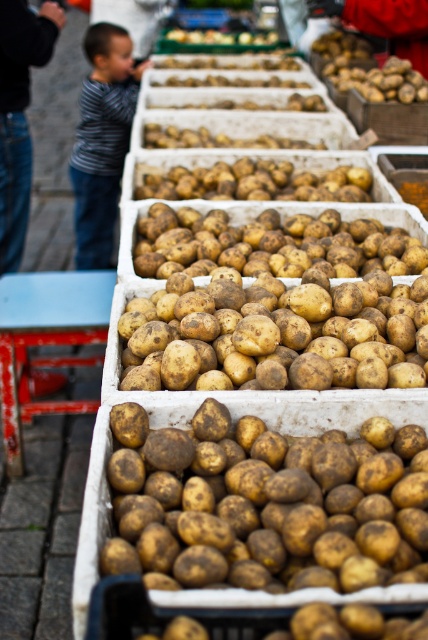
This screenshot has height=640, width=428. What do you see at coordinates (259, 346) in the screenshot?
I see `brown matte potatoes at center` at bounding box center [259, 346].

Can you confirm if brown matte potatoes at center is taller than rustic brown potato at center?

No, brown matte potatoes at center is not taller than rustic brown potato at center.

The height and width of the screenshot is (640, 428). Find the location of `brown matte potatoes at center`. brown matte potatoes at center is located at coordinates (259, 346).

Can you confirm if brown rough potato at center is positioned above striped shirt at left?

No.

Can you confirm if brown rough potato at center is shorter than striped shirt at left?

Yes, brown rough potato at center is shorter than striped shirt at left.

What do you see at coordinates (253, 508) in the screenshot? I see `brown rough potato at center` at bounding box center [253, 508].

The height and width of the screenshot is (640, 428). What are the coordinates of `brown rough potato at center` in the screenshot? It's located at (253, 508).

Who is more forward, (x=392, y=557) or (x=419, y=381)?

Point (x=392, y=557) is in front.

Who is positioned more to the left, brown rough potato at center or brown matte potatoes at center?

brown rough potato at center is more to the left.

Who is more forward, (x=118, y=428) or (x=204, y=387)?

Point (x=118, y=428) is more forward.

Where is `brown rough potato at center`? This screenshot has width=428, height=640. brown rough potato at center is located at coordinates (253, 508).